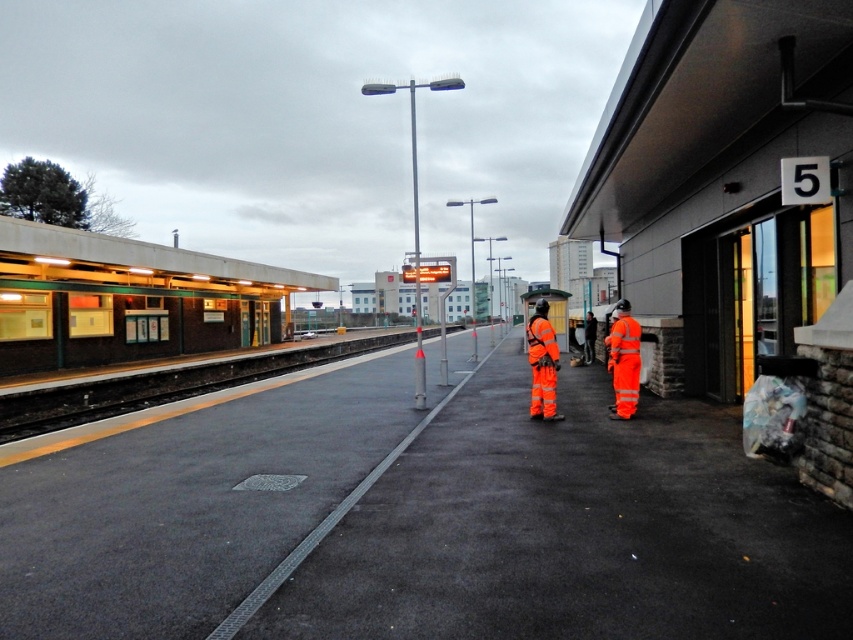
Consider the image. Does high-visibility orange jumpsuit at right have a greater width compared to high visibility orange reflective jacket at center?

Incorrect, high-visibility orange jumpsuit at right's width does not surpass high visibility orange reflective jacket at center's.

Does point (637, 348) come in front of point (532, 417)?

Yes, it is in front of point (532, 417).

The height and width of the screenshot is (640, 853). What are the coordinates of `high-visibility orange jumpsuit at right` in the screenshot? It's located at (624, 362).

Between high-visibility orange jumpsuit at right and orange reflective safety vest at center, which one is positioned higher?

high-visibility orange jumpsuit at right is above.

Between high-visibility orange jumpsuit at right and orange reflective safety vest at center, which one appears on the right side from the viewer's perspective?

orange reflective safety vest at center is more to the right.

Which is in front, point (633, 358) or point (590, 333)?

Point (633, 358)

The height and width of the screenshot is (640, 853). Identify the location of high-visibility orange jumpsuit at right. (624, 362).

How much distance is there between high visibility orange reflective jacket at center and orange reflective safety vest at center?

The distance of high visibility orange reflective jacket at center from orange reflective safety vest at center is 9.34 meters.

Is high visibility orange reflective jacket at center positioned at the back of orange reflective safety vest at center?

That is False.

Locate an element on the screen. The image size is (853, 640). high visibility orange reflective jacket at center is located at coordinates (543, 364).